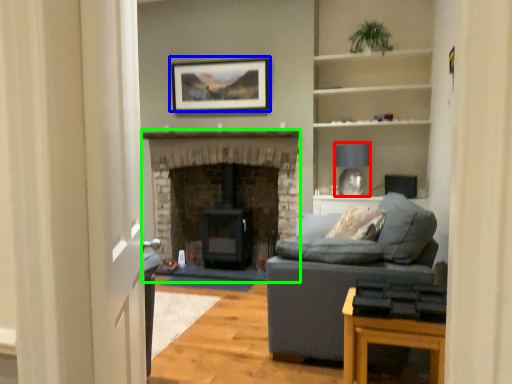
Question: Based on their relative distances, which object is farther from lamp (highlighted by a red box)? Choose from picture frame (highlighted by a blue box) and fireplace (highlighted by a green box).

Choices:
 (A) picture frame
 (B) fireplace

Answer: (A)